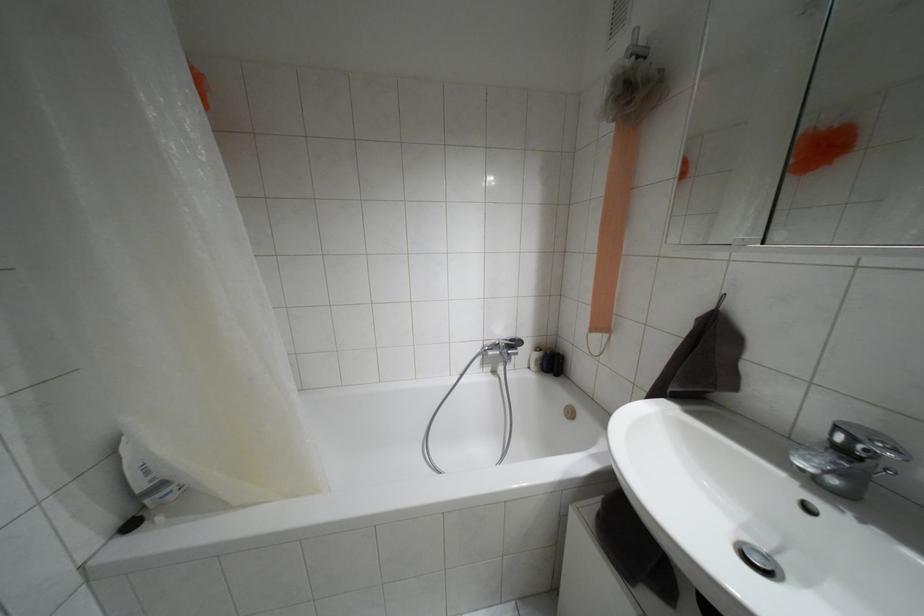
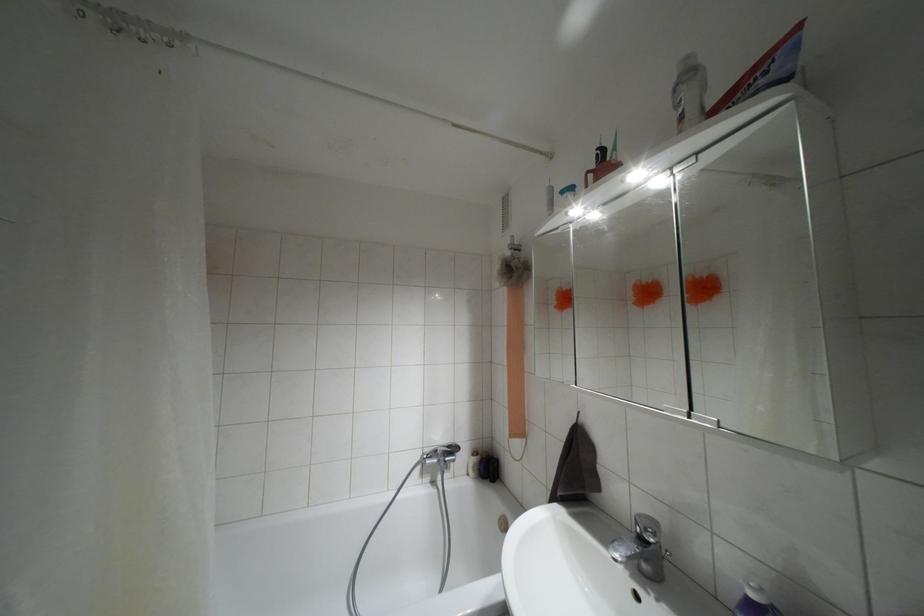
Find the pixel in the second image that matches (x=511, y=339) in the first image.

(447, 446)